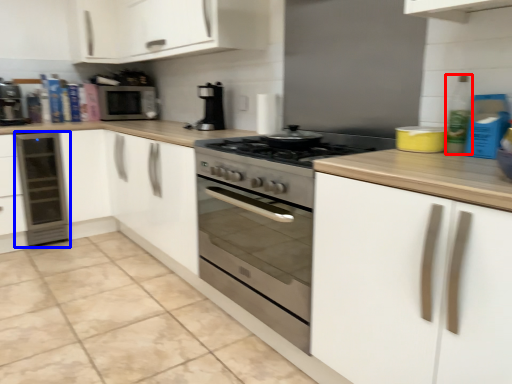
Question: Which point is closer to the camera, bottle (highlighted by a red box) or home appliance (highlighted by a blue box)?

Choices:
 (A) bottle
 (B) home appliance

Answer: (A)